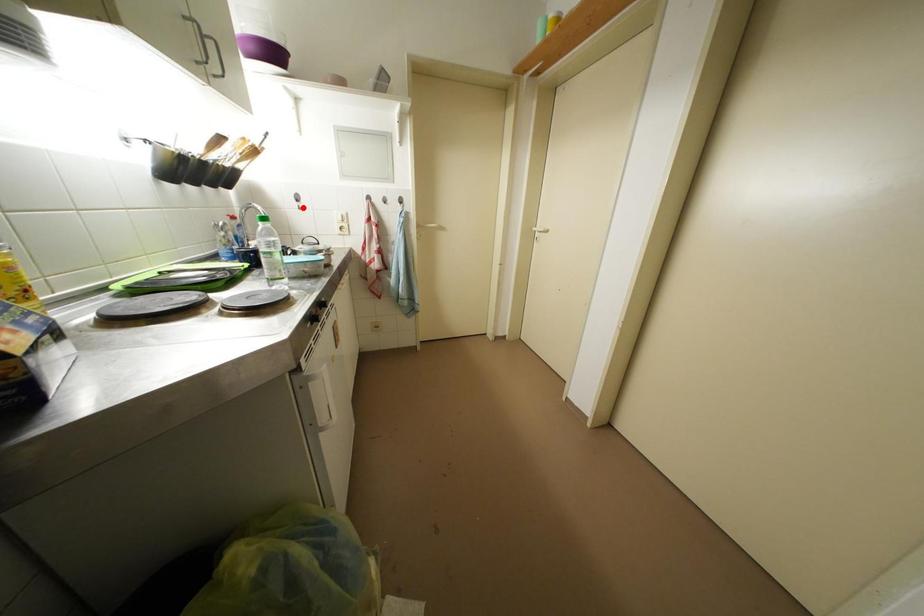
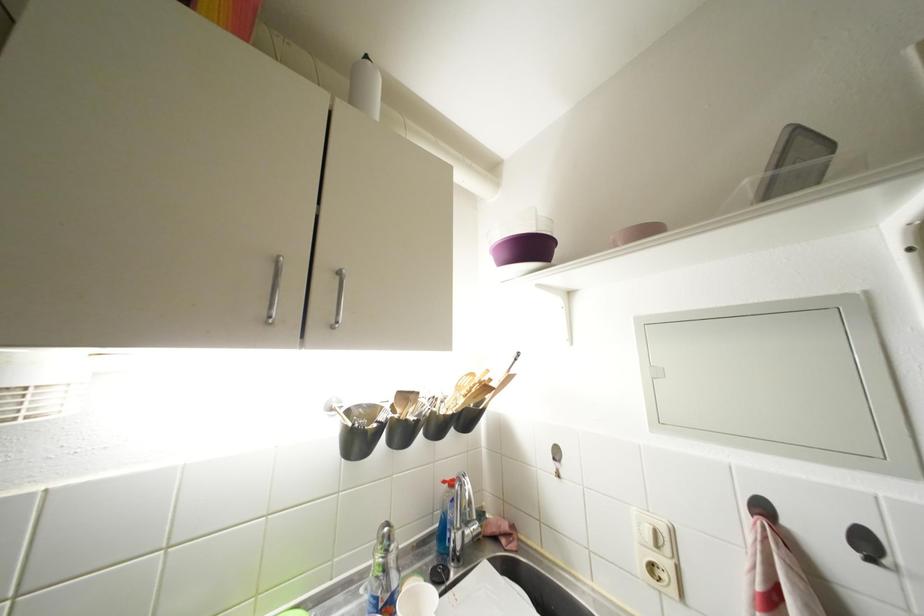
Find the pixel in the second image that matches the highlighted location in the first image.

(560, 469)